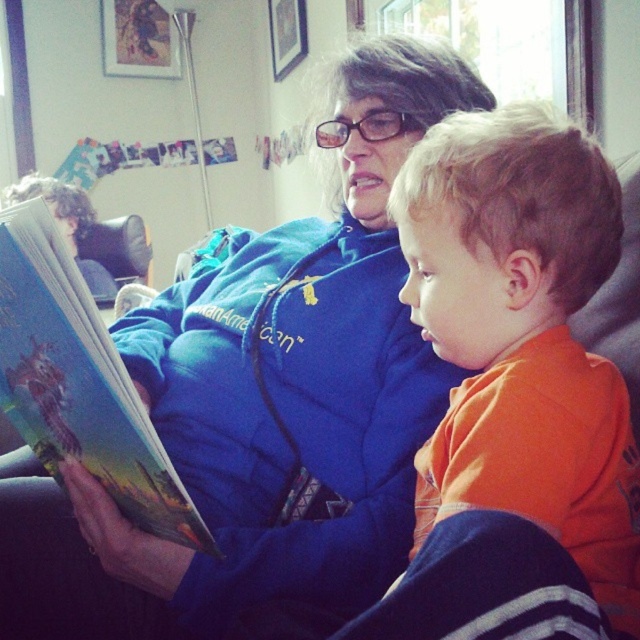
You are a photographer trying to capture a candid shot of the orange cotton shirt at center and the hardcover book at left. Since you want to focus on the shirt, should you adjust your camera to focus on the foreground or background?

The orange cotton shirt at center is in front of the hardcover book at left, so to focus on the shirt, you should set your camera to focus on the foreground.

You are a tailor measuring for a jacket. You see the blue fleece jacket at center and the hardcover book at left. Which object is taller?

The blue fleece jacket at center is taller than the hardcover book at left.

You are a photographer trying to capture a candid shot of the orange cotton shirt at center and the hardcover book at left without them noticing. Since you want to ensure both subjects are in focus, you need to know their heights. Can you tell me which one is taller?

The orange cotton shirt at center has a greater height compared to the hardcover book at left, so the orange cotton shirt at center is taller.